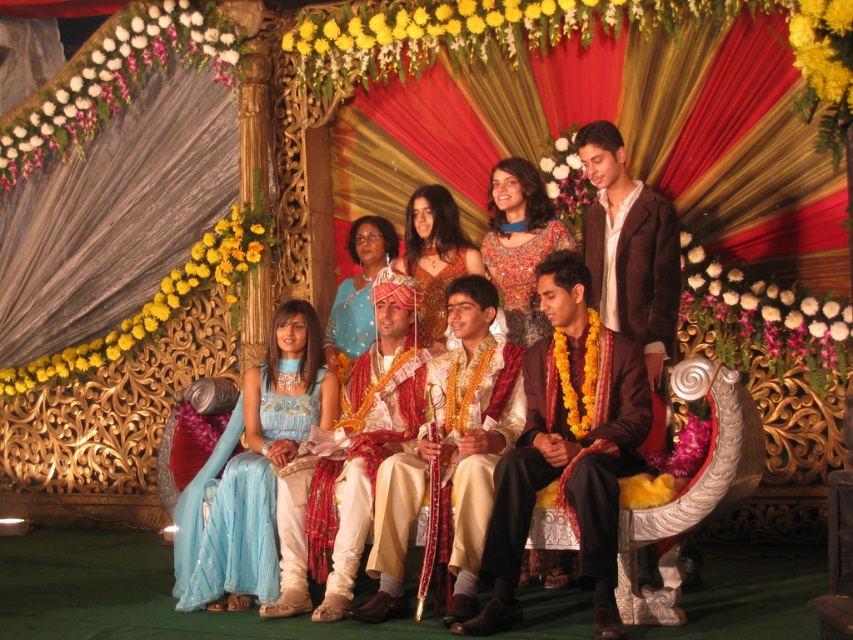
Is light blue silk dress at center to the right of shiny gold dress at center from the viewer's perspective?

In fact, light blue silk dress at center is to the left of shiny gold dress at center.

Measure the distance between light blue silk dress at center and shiny gold dress at center.

The distance of light blue silk dress at center from shiny gold dress at center is 5.62 meters.

Is point (219, 467) positioned before point (460, 257)?

Yes.

This screenshot has height=640, width=853. Identify the location of light blue silk dress at center. (257, 468).

Can you confirm if brown satin suit at center is thinner than embroidered silk blouse at center?

Yes.

Describe the element at coordinates (630, 248) in the screenshot. This screenshot has height=640, width=853. I see `brown satin suit at center` at that location.

Which is behind, point (606, 176) or point (511, 220)?

The point (511, 220) is more distant.

Locate an element on the screen. This screenshot has width=853, height=640. brown satin suit at center is located at coordinates (630, 248).

Measure the distance between shiny brown suit at center and shiny gold dress at center.

shiny brown suit at center and shiny gold dress at center are 7.11 meters apart.

Between point (543, 387) and point (421, 332), which one is positioned behind?

The point (421, 332) is more distant.

Where is `shiny brown suit at center`? Image resolution: width=853 pixels, height=640 pixels. shiny brown suit at center is located at coordinates (567, 445).